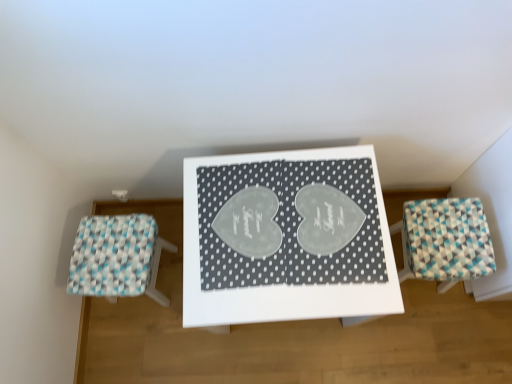
Where is `teal-patterned stool at right, placed as the 2th furniture when sorted from left to right`? teal-patterned stool at right, placed as the 2th furniture when sorted from left to right is located at coordinates (445, 241).

The height and width of the screenshot is (384, 512). Find the location of `white glossy table at center`. white glossy table at center is located at coordinates (286, 237).

Identify the location of white woven stool at left, the 2th furniture positioned from the right. The width and height of the screenshot is (512, 384). pyautogui.click(x=117, y=257).

At what (x,y) coordinates should I click in order to perform the action: click on teal-patterned stool at right, placed as the 2th furniture when sorted from left to right. Please return your answer as a coordinate pair (x, y). Looking at the image, I should click on (445, 241).

Between white woven stool at left, the 2th furniture positioned from the right, and white glossy table at center, which one has more height?

Standing taller between the two is white glossy table at center.

Are white woven stool at left, the 2th furniture positioned from the right, and white glossy table at center located far from each other?

No, white woven stool at left, the 2th furniture positioned from the right, is not far away from white glossy table at center.

Can you confirm if white woven stool at left, the 1th furniture viewed from the left, is wider than white glossy table at center?

In fact, white woven stool at left, the 1th furniture viewed from the left, might be narrower than white glossy table at center.

Is point (104, 219) less distant than point (211, 267)?

No, (104, 219) is behind (211, 267).

Which object is further away from the camera taking this photo, white glossy table at center or white woven stool at left, the 1th furniture viewed from the left?

white woven stool at left, the 1th furniture viewed from the left, is more distant.

Image resolution: width=512 pixels, height=384 pixels. I want to click on furniture that is the 2nd object located behind the white glossy table at center, so click(117, 257).

Considering the points (313, 176) and (68, 285), which point is behind, point (313, 176) or point (68, 285)?

Point (68, 285)

Image resolution: width=512 pixels, height=384 pixels. In order to click on table lying on the left of teal-patterned stool at right, which is the 1th furniture in right-to-left order in this screenshot , I will do `click(286, 237)`.

Is white glossy table at center shorter than teal-patterned stool at right, which is the 1th furniture in right-to-left order?

Incorrect, the height of white glossy table at center does not fall short of that of teal-patterned stool at right, which is the 1th furniture in right-to-left order.

Considering the positions of objects white glossy table at center and teal-patterned stool at right, which is the 1th furniture in right-to-left order, in the image provided, who is behind, white glossy table at center or teal-patterned stool at right, which is the 1th furniture in right-to-left order,?

teal-patterned stool at right, which is the 1th furniture in right-to-left order, is further away from the camera.

Looking at the image, does white glossy table at center seem bigger or smaller compared to teal-patterned stool at right, which is the 1th furniture in right-to-left order?

Considering their sizes, white glossy table at center takes up more space than teal-patterned stool at right, which is the 1th furniture in right-to-left order.

The image size is (512, 384). In order to click on table below the teal-patterned stool at right, which is the 1th furniture in right-to-left order (from the image's perspective) in this screenshot , I will do `click(286, 237)`.

What's the angular difference between teal-patterned stool at right, which is the 1th furniture in right-to-left order, and white glossy table at center's facing directions?

The angle between the facing direction of teal-patterned stool at right, which is the 1th furniture in right-to-left order, and the facing direction of white glossy table at center is 93.1 degrees.

From the picture: Would you say teal-patterned stool at right, placed as the 2th furniture when sorted from left to right, contains white glossy table at center?

No, white glossy table at center is not surrounded by teal-patterned stool at right, placed as the 2th furniture when sorted from left to right.

Is point (423, 250) in front of point (191, 189)?

That is False.

Between white woven stool at left, the 1th furniture viewed from the left, and teal-patterned stool at right, placed as the 2th furniture when sorted from left to right, which one has smaller width?

white woven stool at left, the 1th furniture viewed from the left, is thinner.

Is white woven stool at left, the 2th furniture positioned from the right, completely or partially outside of teal-patterned stool at right, placed as the 2th furniture when sorted from left to right?

white woven stool at left, the 2th furniture positioned from the right, is positioned outside teal-patterned stool at right, placed as the 2th furniture when sorted from left to right.

From a real-world perspective, who is located higher, white woven stool at left, the 2th furniture positioned from the right, or teal-patterned stool at right, which is the 1th furniture in right-to-left order?

From a 3D spatial view, teal-patterned stool at right, which is the 1th furniture in right-to-left order, is above.

How different are the orientations of white woven stool at left, the 2th furniture positioned from the right, and teal-patterned stool at right, placed as the 2th furniture when sorted from left to right, in degrees?

176 degrees separate the facing orientations of white woven stool at left, the 2th furniture positioned from the right, and teal-patterned stool at right, placed as the 2th furniture when sorted from left to right.

Is white woven stool at left, the 1th furniture viewed from the left, at the back of teal-patterned stool at right, which is the 1th furniture in right-to-left order?

That's not correct — teal-patterned stool at right, which is the 1th furniture in right-to-left order, is not looking away from white woven stool at left, the 1th furniture viewed from the left.

Is teal-patterned stool at right, which is the 1th furniture in right-to-left order, behind white woven stool at left, the 2th furniture positioned from the right?

No, it is in front of white woven stool at left, the 2th furniture positioned from the right.

Which object is wider, teal-patterned stool at right, placed as the 2th furniture when sorted from left to right, or white woven stool at left, the 2th furniture positioned from the right?

With larger width is teal-patterned stool at right, placed as the 2th furniture when sorted from left to right.

Is teal-patterned stool at right, which is the 1th furniture in right-to-left order, in contact with white woven stool at left, the 1th furniture viewed from the left?

No.

The width and height of the screenshot is (512, 384). What are the coordinates of `table located above the white woven stool at left, the 1th furniture viewed from the left (from a real-world perspective)` in the screenshot? It's located at (286, 237).

You are a GUI agent. You are given a task and a screenshot of the screen. Output one action in this format:
    pyautogui.click(x=<x>, y=<y>)
    Task: Click on the 2nd furniture behind when counting from the white glossy table at center
    Image resolution: width=512 pixels, height=384 pixels.
    Given the screenshot: What is the action you would take?
    pyautogui.click(x=117, y=257)

Based on their spatial positions, is teal-patterned stool at right, placed as the 2th furniture when sorted from left to right, or white glossy table at center further from white woven stool at left, the 1th furniture viewed from the left?

The object further to white woven stool at left, the 1th furniture viewed from the left, is teal-patterned stool at right, placed as the 2th furniture when sorted from left to right.

Considering their positions, is teal-patterned stool at right, placed as the 2th furniture when sorted from left to right, positioned closer to white glossy table at center than white woven stool at left, the 1th furniture viewed from the left?

teal-patterned stool at right, placed as the 2th furniture when sorted from left to right, is closer to white glossy table at center.

When comparing their distances from teal-patterned stool at right, which is the 1th furniture in right-to-left order, does white glossy table at center or white woven stool at left, the 1th furniture viewed from the left, seem further?

white woven stool at left, the 1th furniture viewed from the left, is positioned further to the anchor teal-patterned stool at right, which is the 1th furniture in right-to-left order.

Looking at the image, which one is located closer to white woven stool at left, the 1th furniture viewed from the left, white glossy table at center or teal-patterned stool at right, placed as the 2th furniture when sorted from left to right?

The object closer to white woven stool at left, the 1th furniture viewed from the left, is white glossy table at center.

From the image, which object appears to be nearer to teal-patterned stool at right, which is the 1th furniture in right-to-left order, white woven stool at left, the 2th furniture positioned from the right, or white glossy table at center?

white glossy table at center is positioned closer to the anchor teal-patterned stool at right, which is the 1th furniture in right-to-left order.

Estimate the real-world distances between objects in this image. Which object is further from white glossy table at center, white woven stool at left, the 1th furniture viewed from the left, or teal-patterned stool at right, which is the 1th furniture in right-to-left order?

white woven stool at left, the 1th furniture viewed from the left, is further to white glossy table at center.

The height and width of the screenshot is (384, 512). I want to click on table between white woven stool at left, the 2th furniture positioned from the right, and teal-patterned stool at right, placed as the 2th furniture when sorted from left to right, from left to right, so click(x=286, y=237).